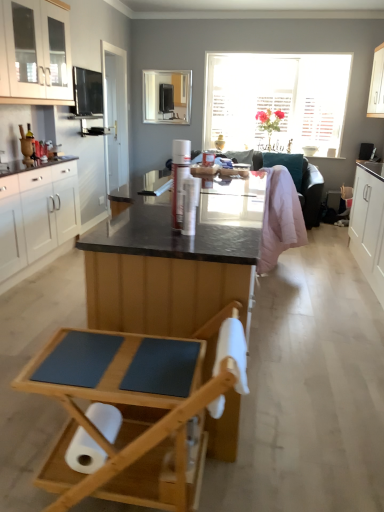
This screenshot has width=384, height=512. Describe the element at coordinates (276, 100) in the screenshot. I see `translucent glass window at upper center` at that location.

What do you see at coordinates (37, 219) in the screenshot? This screenshot has height=512, width=384. I see `white glossy cabinets at left, which is the 1th cabinetry in left-to-right order` at bounding box center [37, 219].

Image resolution: width=384 pixels, height=512 pixels. I want to click on matte black tv at upper center, so click(166, 96).

The height and width of the screenshot is (512, 384). In order to click on white glossy door at center in this screenshot , I will do `click(116, 116)`.

Describe the element at coordinates (35, 52) in the screenshot. The image size is (384, 512). I see `white glossy cabinets at upper left, which ranks as the third cabinetry in right-to-left order` at that location.

Identify the location of white glossy cabinets at upper left, which ranks as the third cabinetry in right-to-left order. (35, 52).

The width and height of the screenshot is (384, 512). In order to click on translucent glass window at upper center in this screenshot , I will do `click(276, 100)`.

Who is shorter, white glossy cabinet at upper right, which is the fourth cabinetry from left to right, or translucent glass window at upper center?

white glossy cabinet at upper right, which is the fourth cabinetry from left to right, is shorter.

From a real-world perspective, is white glossy cabinet at upper right, the first cabinetry from the right, under translucent glass window at upper center?

A: Actually, white glossy cabinet at upper right, the first cabinetry from the right, is physically above translucent glass window at upper center in the real world.

Considering the relative positions of white glossy cabinet at upper right, which is the fourth cabinetry from left to right, and translucent glass window at upper center in the image provided, is white glossy cabinet at upper right, which is the fourth cabinetry from left to right, to the left or to the right of translucent glass window at upper center?

Based on their positions, white glossy cabinet at upper right, which is the fourth cabinetry from left to right, is located to the right of translucent glass window at upper center.

Between point (383, 78) and point (253, 128), which one is positioned behind?

The point (253, 128) is behind.

Which of these two, white glossy cabinets at left, which is the 1th cabinetry in left-to-right order, or teal fabric couch at center, stands taller?

white glossy cabinets at left, which is the 1th cabinetry in left-to-right order.

From a real-world perspective, is white glossy cabinets at left, which is the 1th cabinetry in left-to-right order, over teal fabric couch at center?

Yes, from a real-world perspective, white glossy cabinets at left, which is the 1th cabinetry in left-to-right order, is over teal fabric couch at center

What's the angular difference between white glossy cabinets at left, which is the 1th cabinetry in left-to-right order, and teal fabric couch at center's facing directions?

There is a 90.1-degree angle between the facing directions of white glossy cabinets at left, which is the 1th cabinetry in left-to-right order, and teal fabric couch at center.

Is white glossy cabinets at left, the 4th cabinetry in the right-to-left sequence, placed right next to teal fabric couch at center?

No, white glossy cabinets at left, the 4th cabinetry in the right-to-left sequence, is not in contact with teal fabric couch at center.

Is white matte toilet paper at lower left, marked as the second toilet paper in a front-to-back arrangement, further to the viewer compared to translucent glass window at upper center?

That is False.

From a real-world perspective, who is located lower, white matte toilet paper at lower left, which is the 1th toilet paper from left to right, or translucent glass window at upper center?

In real-world perspective, white matte toilet paper at lower left, which is the 1th toilet paper from left to right, is lower.

Are white matte toilet paper at lower left, which is the first toilet paper in bottom-to-top order, and translucent glass window at upper center beside each other?

white matte toilet paper at lower left, which is the first toilet paper in bottom-to-top order, and translucent glass window at upper center are clearly separated.

Can you confirm if white matte toilet paper at lower left, placed as the second toilet paper when sorted from right to left, is positioned to the right of translucent glass window at upper center?

No.

Is wooden folding chair at lower center turned away from teal fabric couch at center?

Yes, wooden folding chair at lower center's orientation is away from teal fabric couch at center.

Can teal fabric couch at center be found inside wooden folding chair at lower center?

Actually, teal fabric couch at center is outside wooden folding chair at lower center.

Is wooden folding chair at lower center taller than teal fabric couch at center?

No, wooden folding chair at lower center is not taller than teal fabric couch at center.

What's the angular difference between white glossy cabinets at upper left, positioned as the second cabinetry in left-to-right order, and teal fabric couch at center's facing directions?

91.1 degrees separate the facing orientations of white glossy cabinets at upper left, positioned as the second cabinetry in left-to-right order, and teal fabric couch at center.

Is white glossy cabinets at upper left, which ranks as the third cabinetry in right-to-left order, turned away from teal fabric couch at center?

No.

In the image, is white glossy cabinets at upper left, positioned as the second cabinetry in left-to-right order, on the left side or the right side of teal fabric couch at center?

white glossy cabinets at upper left, positioned as the second cabinetry in left-to-right order, is positioned on teal fabric couch at center's left side.

Based on the photo, can you confirm if white glossy cabinets at upper left, positioned as the second cabinetry in left-to-right order, is shorter than teal fabric couch at center?

Yes, white glossy cabinets at upper left, positioned as the second cabinetry in left-to-right order, is shorter than teal fabric couch at center.

Considering the positions of objects wooden folding chair at lower center and white glossy door at center in the image provided, who is more to the left, wooden folding chair at lower center or white glossy door at center?

white glossy door at center is more to the left.

From a real-world perspective, is wooden folding chair at lower center below white glossy door at center?

Yes, from a real-world perspective, wooden folding chair at lower center is under white glossy door at center.

Is white glossy door at center at the back of wooden folding chair at lower center?

Yes, wooden folding chair at lower center is facing away from white glossy door at center.

Is wooden folding chair at lower center surrounding white glossy door at center?

No, white glossy door at center is not a part of wooden folding chair at lower center.

Would you say teal fabric couch at center is a long distance from pink quilted blanket at center?

Absolutely, teal fabric couch at center is distant from pink quilted blanket at center.

Can you confirm if teal fabric couch at center is wider than pink quilted blanket at center?

Yes, teal fabric couch at center is wider than pink quilted blanket at center.

Find the location of `couch that appears on the left of pink quilted blanket at center`. couch that appears on the left of pink quilted blanket at center is located at coordinates (311, 193).

In the scene shown: From the image's perspective, which object appears higher, teal fabric couch at center or pink quilted blanket at center?

From the image's view, teal fabric couch at center is above.

I want to click on window to the left of white glossy cabinet at upper right, which is the fourth cabinetry from left to right, so click(276, 100).

Find the location of a particular element. the 1st cabinetry below when counting from the teal fabric couch at center (from the image's perspective) is located at coordinates click(x=37, y=219).

Considering their positions, is white glossy cabinet at right, the second cabinetry when ordered from right to left, positioned further to wooden folding chair at lower center than pink quilted blanket at center?

white glossy cabinet at right, the second cabinetry when ordered from right to left, lies further to wooden folding chair at lower center than the other object.

From the image, which object appears to be nearer to white matte toilet paper at lower center, which ranks as the 1th toilet paper in right-to-left order, white matte toilet paper at lower left, marked as the second toilet paper in a front-to-back arrangement, or translucent glass window at upper center?

white matte toilet paper at lower left, marked as the second toilet paper in a front-to-back arrangement, lies closer to white matte toilet paper at lower center, which ranks as the 1th toilet paper in right-to-left order, than the other object.

From the picture: Which object lies further to the anchor point translucent glass window at upper center, matte black tv at upper center or white glossy door at center?

The object further to translucent glass window at upper center is white glossy door at center.

Considering their positions, is white glossy cabinet at upper right, which is the fourth cabinetry from left to right, positioned further to teal fabric couch at center than white glossy cabinets at upper left, which ranks as the third cabinetry in right-to-left order?

white glossy cabinets at upper left, which ranks as the third cabinetry in right-to-left order, is positioned further to the anchor teal fabric couch at center.

Based on the photo, from the image, which object appears to be nearer to translucent glass window at upper center, white glossy cabinet at upper right, which is the fourth cabinetry from left to right, or white matte toilet paper at lower center, which is counted as the 2th toilet paper, starting from the back?

Based on the image, white glossy cabinet at upper right, which is the fourth cabinetry from left to right, appears to be nearer to translucent glass window at upper center.

Based on the photo, from the image, which object appears to be nearer to teal fabric couch at center, translucent glass window at upper center or white glossy cabinet at right, the second cabinetry when ordered from right to left?

white glossy cabinet at right, the second cabinetry when ordered from right to left, lies closer to teal fabric couch at center than the other object.

Estimate the real-world distances between objects in this image. Which object is closer to white glossy cabinet at right, which ranks as the third cabinetry in left-to-right order, wooden folding chair at lower center or white glossy cabinets at upper left, positioned as the second cabinetry in left-to-right order?

wooden folding chair at lower center is closer to white glossy cabinet at right, which ranks as the third cabinetry in left-to-right order.

Which object lies further to the anchor point translucent glass window at upper center, white glossy cabinet at right, which ranks as the third cabinetry in left-to-right order, or white matte toilet paper at lower center, which is counted as the second toilet paper, starting from the bottom?

white matte toilet paper at lower center, which is counted as the second toilet paper, starting from the bottom, lies further to translucent glass window at upper center than the other object.

In order to click on blanket located between wooden folding chair at lower center and teal fabric couch at center in the depth direction in this screenshot , I will do `click(280, 218)`.

This screenshot has height=512, width=384. I want to click on blanket between white matte toilet paper at lower left, which is the first toilet paper in bottom-to-top order, and white glossy cabinet at right, which ranks as the third cabinetry in left-to-right order, from left to right, so click(280, 218).

At what (x,y) coordinates should I click in order to perform the action: click on blanket between white glossy cabinets at left, which is the 1th cabinetry in left-to-right order, and white glossy cabinet at upper right, which is the fourth cabinetry from left to right, in the horizontal direction. Please return your answer as a coordinate pair (x, y). This screenshot has height=512, width=384. Looking at the image, I should click on (280, 218).

Identify the location of blanket between white glossy cabinets at upper left, which ranks as the third cabinetry in right-to-left order, and white glossy cabinet at right, which ranks as the third cabinetry in left-to-right order. [x=280, y=218].